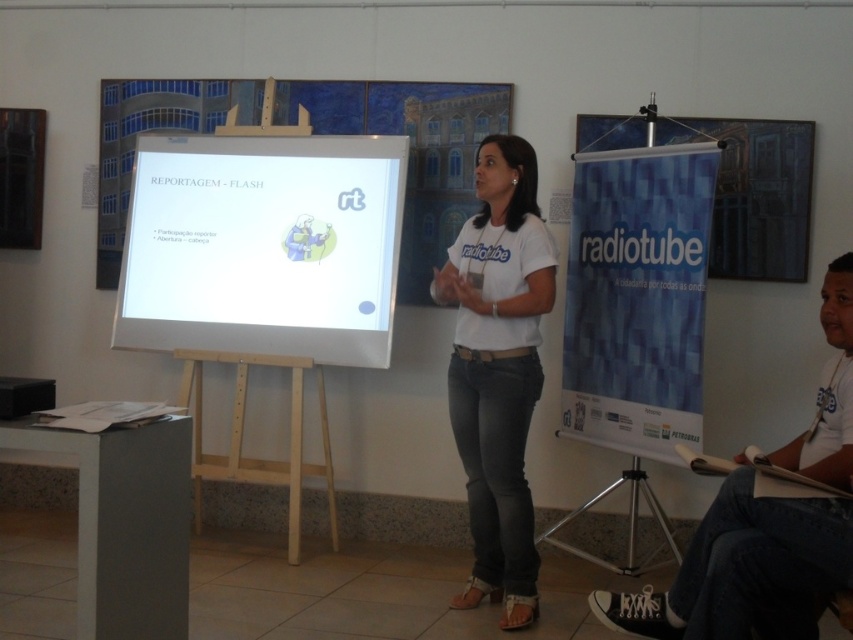
Does white glossy projection screen at center have a smaller size compared to light wood easel at center?

Incorrect, white glossy projection screen at center is not smaller in size than light wood easel at center.

Is point (310, 157) positioned in front of point (280, 472)?

That is True.

I want to click on white glossy projection screen at center, so click(263, 246).

Is point (714, 634) positioned before point (283, 358)?

Yes, point (714, 634) is closer to viewer.

The height and width of the screenshot is (640, 853). Describe the element at coordinates (746, 568) in the screenshot. I see `white t-shirt at center` at that location.

Locate an element on the screen. This screenshot has height=640, width=853. white t-shirt at center is located at coordinates (746, 568).

Does white cotton shirt at center come in front of white t-shirt at center?

No, it is not.

This screenshot has width=853, height=640. What do you see at coordinates (498, 369) in the screenshot? I see `white cotton shirt at center` at bounding box center [498, 369].

Where is `white cotton shirt at center`? This screenshot has height=640, width=853. white cotton shirt at center is located at coordinates [x=498, y=369].